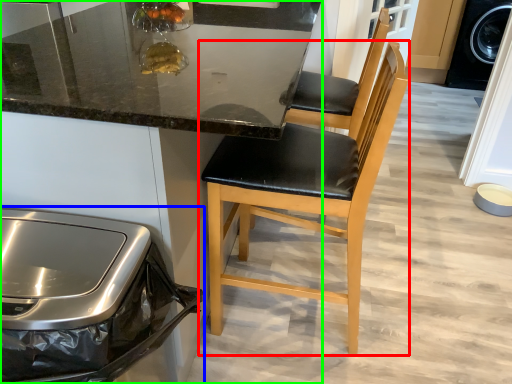
Question: Estimate the real-world distances between objects in this image. Which object is farther from chair (highlighted by a red box), home appliance (highlighted by a blue box) or cabinetry (highlighted by a green box)?

Choices:
 (A) home appliance
 (B) cabinetry

Answer: (A)